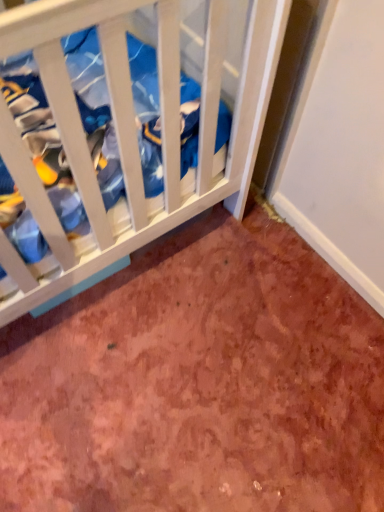
Question: Is brown textured carpet at lower center wider or thinner than white wood crib at upper left?

Choices:
 (A) thin
 (B) wide

Answer: (B)

Question: Is brown textured carpet at lower center bigger or smaller than white wood crib at upper left?

Choices:
 (A) small
 (B) big

Answer: (A)

Question: From a real-world perspective, is brown textured carpet at lower center above or below white wood crib at upper left?

Choices:
 (A) above
 (B) below

Answer: (B)

Question: Relative to brown textured carpet at lower center, is white wood crib at upper left in front or behind?

Choices:
 (A) behind
 (B) front

Answer: (B)

Question: Is white wood crib at upper left to the left or to the right of brown textured carpet at lower center in the image?

Choices:
 (A) left
 (B) right

Answer: (A)

Question: Looking at the image, does white wood crib at upper left seem bigger or smaller compared to brown textured carpet at lower center?

Choices:
 (A) big
 (B) small

Answer: (A)

Question: From the image's perspective, is white wood crib at upper left above or below brown textured carpet at lower center?

Choices:
 (A) below
 (B) above

Answer: (B)